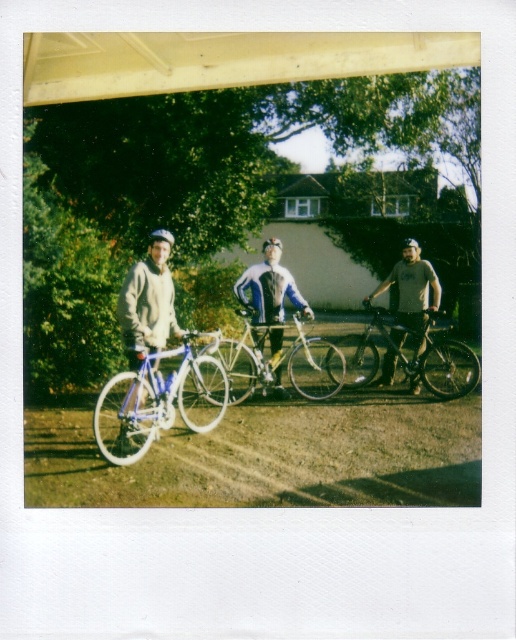
You are a photographer trying to capture a photo of the shiny black bicycle at center and the matte gray shirt at center. Based on their positions, which object is closer to the ground?

The shiny black bicycle at center is closer to the ground because it is positioned below the matte gray shirt at center.

You are a delivery person who needs to place a package between the white gravel at center and the matte white bicycle at left. The package requires a space of 6 feet. Is there enough space?

The white gravel at center is 5.80 feet from the matte white bicycle at left, so the space is insufficient for the 6 feet required package. The package won